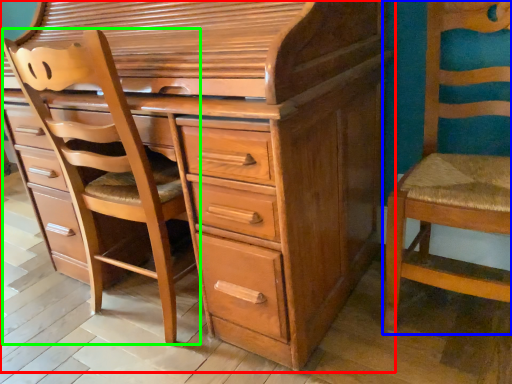
Question: Which is farther away from chest of drawers (highlighted by a red box)? chair (highlighted by a blue box) or armchair (highlighted by a green box)?

Choices:
 (A) chair
 (B) armchair

Answer: (A)